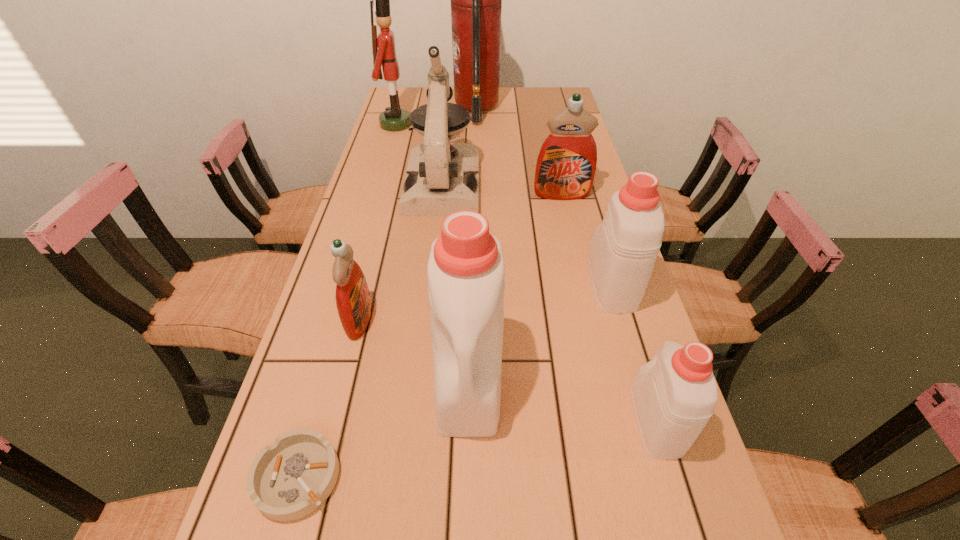
What are the coordinates of `vacant space situated 0.360m on the handle side of the smallest white detergent` in the screenshot? It's located at coord(607,259).

Locate an element on the screen. This screenshot has height=540, width=960. vacant position located on the handle side of the smallest white detergent is located at coordinates (627, 325).

Identify the location of vacant region located 0.220m on the handle side of the smallest white detergent. This screenshot has height=540, width=960. (619, 301).

Image resolution: width=960 pixels, height=540 pixels. Find the location of `vacant area located 0.140m on the front surface of the left red detergent`. vacant area located 0.140m on the front surface of the left red detergent is located at coordinates (435, 319).

Where is `vacant space situated 0.080m on the right of the shortest object`? The height and width of the screenshot is (540, 960). vacant space situated 0.080m on the right of the shortest object is located at coordinates (387, 477).

Where is `object located in the far edge section of the desktop`? This screenshot has height=540, width=960. object located in the far edge section of the desktop is located at coordinates (476, 0).

At what (x,y) coordinates should I click in order to perform the action: click on nutcracker located at the left edge. Please return your answer as a coordinate pair (x, y). The width and height of the screenshot is (960, 540). Looking at the image, I should click on point(394,118).

The width and height of the screenshot is (960, 540). What are the coordinates of `microscope at the left edge` in the screenshot? It's located at (441, 178).

The image size is (960, 540). Identify the location of detergent located in the left edge section of the desktop. (353, 301).

Where is `ashtray present at the left edge`? The image size is (960, 540). ashtray present at the left edge is located at coordinates (289, 479).